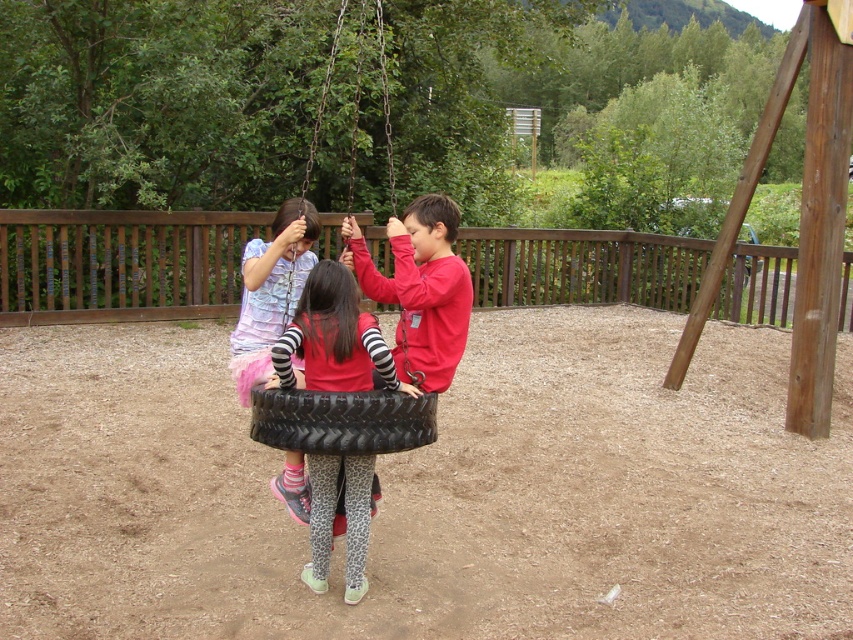
Based on the photo, can you confirm if striped fabric dress at center is thinner than black rubber tire at center?

Yes, striped fabric dress at center is thinner than black rubber tire at center.

What do you see at coordinates (270, 291) in the screenshot? The width and height of the screenshot is (853, 640). I see `striped fabric dress at center` at bounding box center [270, 291].

At what (x,y) coordinates should I click in order to perform the action: click on striped fabric dress at center. Please return your answer as a coordinate pair (x, y). This screenshot has width=853, height=640. Looking at the image, I should click on (270, 291).

Is red matte shirt at center closer to the viewer compared to striped fabric dress at center?

Yes, red matte shirt at center is in front of striped fabric dress at center.

Can you confirm if red matte shirt at center is smaller than striped fabric dress at center?

Yes, red matte shirt at center is smaller than striped fabric dress at center.

Identify the location of red matte shirt at center. (334, 337).

Describe the element at coordinates (334, 337) in the screenshot. The width and height of the screenshot is (853, 640). I see `red matte shirt at center` at that location.

Is point (321, 385) positioned behind point (425, 433)?

Yes, it is behind point (425, 433).

Locate an element on the screen. The width and height of the screenshot is (853, 640). red matte shirt at center is located at coordinates pyautogui.click(x=334, y=337).

Locate an element on the screen. This screenshot has width=853, height=640. red matte shirt at center is located at coordinates (334, 337).